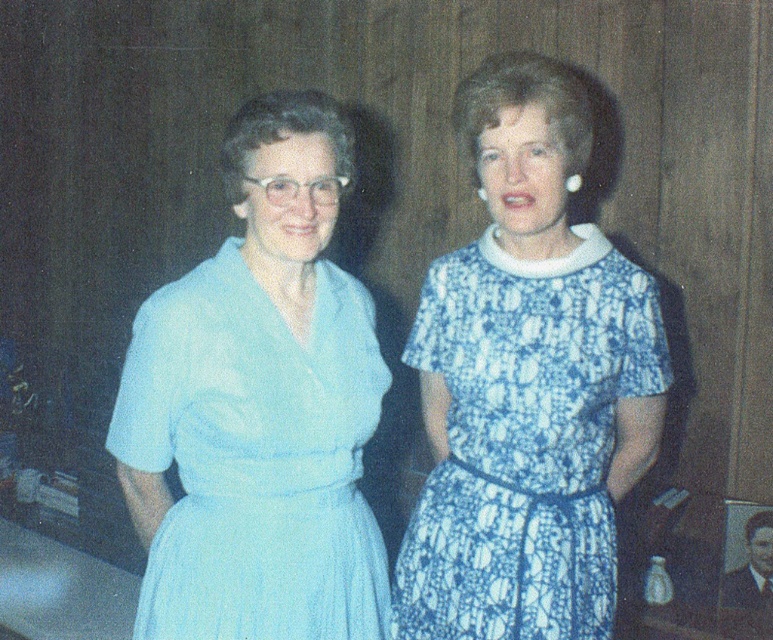
You are an interior designer analyzing a photo of two women in a room with wooden paneling. You need to note the exact position of the light blue fabric dress at left in the image. What are its coordinates?

The light blue fabric dress at left is located at coordinates point (259,404).

You are standing in the room and want to place a small plant between the two points, point (288, 323) and point (509, 321). Which point should the plant be closer to in order to be in front of both points?

The plant should be closer to point (288, 323) because it is in front of point (509, 321).